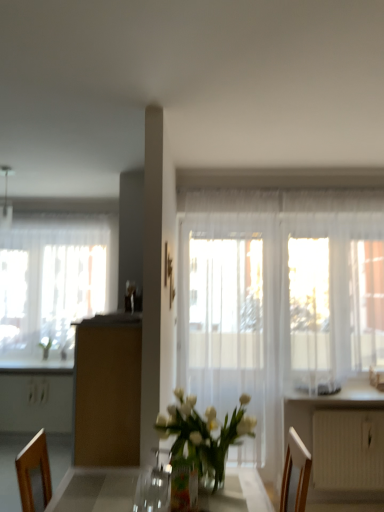
Question: Is brown matte cabinet at center oriented towards white textured radiator at lower right?

Choices:
 (A) no
 (B) yes

Answer: (A)

Question: From the image's perspective, is brown matte cabinet at center located beneath white textured radiator at lower right?

Choices:
 (A) no
 (B) yes

Answer: (A)

Question: Is brown matte cabinet at center smaller than white textured radiator at lower right?

Choices:
 (A) no
 (B) yes

Answer: (A)

Question: Can you confirm if brown matte cabinet at center is shorter than white textured radiator at lower right?

Choices:
 (A) yes
 (B) no

Answer: (B)

Question: Is brown matte cabinet at center facing away from white textured radiator at lower right?

Choices:
 (A) no
 (B) yes

Answer: (B)

Question: Is brown matte cabinet at center completely or partially outside of white textured radiator at lower right?

Choices:
 (A) no
 (B) yes

Answer: (B)

Question: Considering the relative positions of metallic silver lamp at upper left and brown matte cabinet at center in the image provided, is metallic silver lamp at upper left to the right of brown matte cabinet at center from the viewer's perspective?

Choices:
 (A) no
 (B) yes

Answer: (A)

Question: Is metallic silver lamp at upper left taller than brown matte cabinet at center?

Choices:
 (A) no
 (B) yes

Answer: (A)

Question: Is metallic silver lamp at upper left positioned beyond the bounds of brown matte cabinet at center?

Choices:
 (A) yes
 (B) no

Answer: (A)

Question: Is metallic silver lamp at upper left at the left side of brown matte cabinet at center?

Choices:
 (A) yes
 (B) no

Answer: (A)

Question: Does metallic silver lamp at upper left have a smaller size compared to brown matte cabinet at center?

Choices:
 (A) no
 (B) yes

Answer: (B)

Question: Is metallic silver lamp at upper left beside brown matte cabinet at center?

Choices:
 (A) yes
 (B) no

Answer: (B)

Question: Is brown matte cabinet at center positioned behind metallic silver lamp at upper left?

Choices:
 (A) no
 (B) yes

Answer: (A)